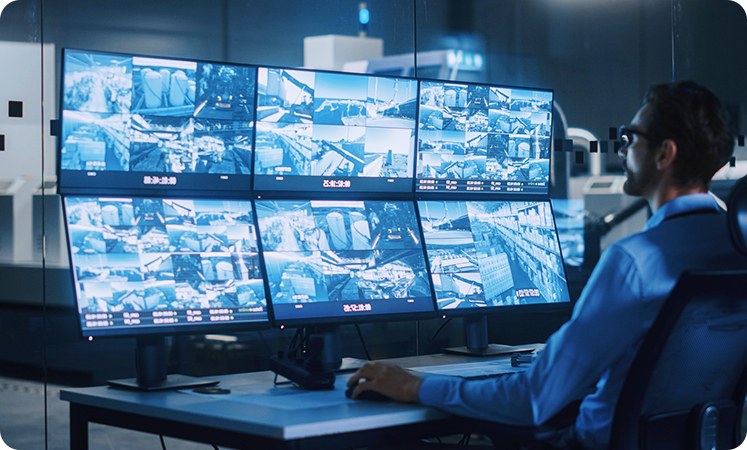
Where is `monitor`? This screenshot has height=450, width=747. monitor is located at coordinates (152, 126), (164, 262), (350, 255), (353, 118), (471, 127), (500, 262).